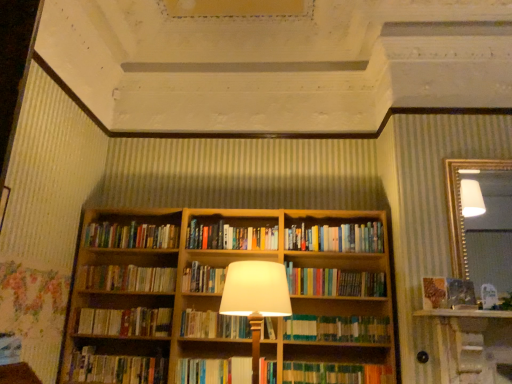
Question: Is hardcover book at center, acting as the second book starting from the bottom, next to wooden bookcase at center?

Choices:
 (A) yes
 (B) no

Answer: (B)

Question: Can you confirm if hardcover book at center, which ranks as the 10th book in top-to-bottom order, is taller than wooden bookcase at center?

Choices:
 (A) no
 (B) yes

Answer: (A)

Question: Can you confirm if hardcover book at center, acting as the second book starting from the bottom, is positioned to the left of wooden bookcase at center?

Choices:
 (A) no
 (B) yes

Answer: (B)

Question: Does hardcover book at center, acting as the second book starting from the bottom, have a larger size compared to wooden bookcase at center?

Choices:
 (A) no
 (B) yes

Answer: (A)

Question: Can you confirm if hardcover book at center, which ranks as the 10th book in top-to-bottom order, is wider than wooden bookcase at center?

Choices:
 (A) yes
 (B) no

Answer: (B)

Question: From a real-world perspective, is hardcover books at center, which is the 10th book in bottom-to-top order, physically located above or below gold-framed mirror at upper right?

Choices:
 (A) below
 (B) above

Answer: (A)

Question: Considering the relative positions of hardcover books at center, which is the 10th book in bottom-to-top order, and gold-framed mirror at upper right in the image provided, is hardcover books at center, which is the 10th book in bottom-to-top order, to the left or to the right of gold-framed mirror at upper right?

Choices:
 (A) left
 (B) right

Answer: (A)

Question: Is point (172, 243) positioned closer to the camera than point (458, 258)?

Choices:
 (A) farther
 (B) closer

Answer: (A)

Question: From the image's perspective, is hardcover books at center, the 2th book from the top, positioned above or below gold-framed mirror at upper right?

Choices:
 (A) above
 (B) below

Answer: (B)

Question: Is wooden bookshelf at center to the left or to the right of hardcover book at center, which is the 5th book from bottom to top, in the image?

Choices:
 (A) left
 (B) right

Answer: (B)

Question: Is point (207, 286) positioned closer to the camera than point (165, 334)?

Choices:
 (A) farther
 (B) closer

Answer: (A)

Question: Is wooden bookshelf at center spatially inside hardcover book at center, the 7th book positioned from the top, or outside of it?

Choices:
 (A) outside
 (B) inside

Answer: (A)

Question: From the image's perspective, relative to hardcover book at center, which is the 5th book from bottom to top, is wooden bookshelf at center above or below?

Choices:
 (A) below
 (B) above

Answer: (B)

Question: Relative to matte brown paper at right, is wooden bookshelf at center in front or behind?

Choices:
 (A) front
 (B) behind

Answer: (B)

Question: Is point (184, 274) closer or farther from the camera than point (428, 294)?

Choices:
 (A) closer
 (B) farther

Answer: (B)